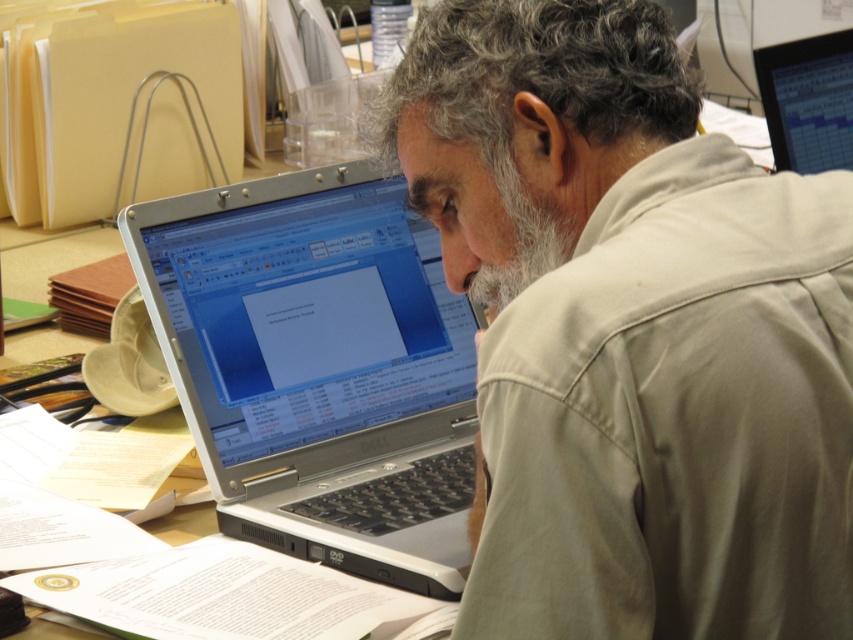
You are a photographer taking a picture of the desk. You notice two points on the desk surface at coordinates point (341, 529) and point (796, 106). Which point will appear larger in the photo?

Point (341, 529) is closer to the camera than point (796, 106), so it will appear larger in the photo.

Based on the scene description, can you determine the spatial relationship between the beige cotton shirt at center and the silver metallic laptop at center?

The beige cotton shirt at center is above the silver metallic laptop at center.